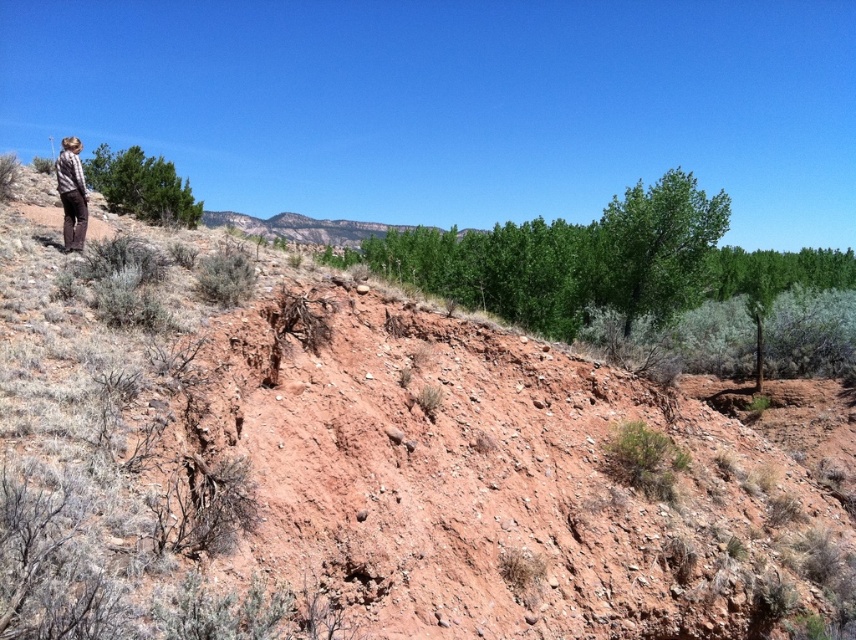
Question: Can you confirm if green leafy tree at upper left is wider than plaid shirt at left?

Choices:
 (A) yes
 (B) no

Answer: (A)

Question: Can you confirm if green leafy tree at upper left is thinner than plaid shirt at left?

Choices:
 (A) no
 (B) yes

Answer: (A)

Question: Is the position of green leafy tree at upper left more distant than that of plaid shirt at left?

Choices:
 (A) no
 (B) yes

Answer: (B)

Question: Which point is closer to the camera?

Choices:
 (A) (721, 230)
 (B) (80, 200)

Answer: (B)

Question: Among these objects, which one is nearest to the camera?

Choices:
 (A) plaid shirt at left
 (B) green leafy tree at upper right

Answer: (A)

Question: Which object appears farthest from the camera in this image?

Choices:
 (A) green leafy tree at upper right
 (B) plaid shirt at left
 (C) green leafy tree at upper left

Answer: (A)